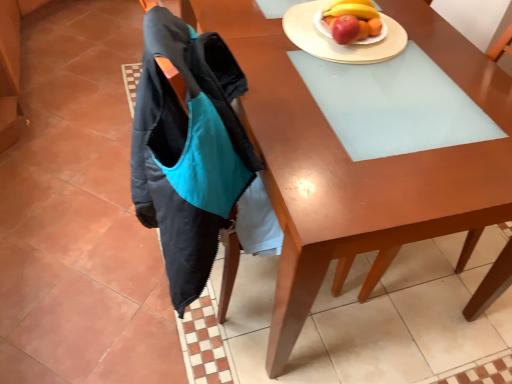
Where is `vacant region in front of wooden plate at upper right, placed as the 1th plate when sorted from left to right`? The image size is (512, 384). vacant region in front of wooden plate at upper right, placed as the 1th plate when sorted from left to right is located at coordinates (359, 98).